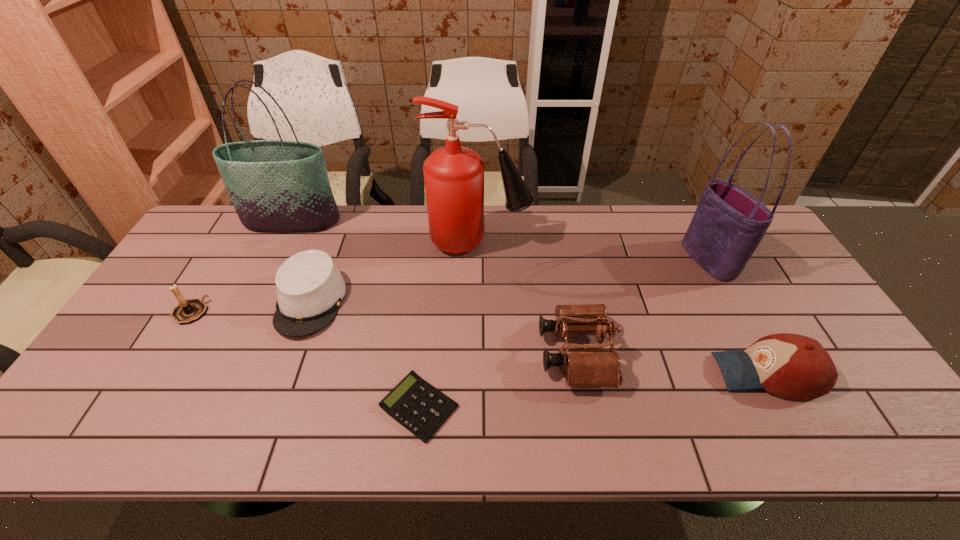
The image size is (960, 540). I want to click on vacant space in between the seventh tallest object and the fire extinguisher, so click(395, 272).

Where is `object that can be found as the third closest to the fire extinguisher`? object that can be found as the third closest to the fire extinguisher is located at coordinates (279, 186).

Locate an element on the screen. The image size is (960, 540). object that can be found as the fourth closest to the farther tote bag is located at coordinates (414, 403).

Find the location of a particular element. The image size is (960, 540). free space that satisfies the following two spatial constraints: 1. with the nozzle aimed from the fire extinguisher; 2. on the front-facing side of the hat is located at coordinates (479, 302).